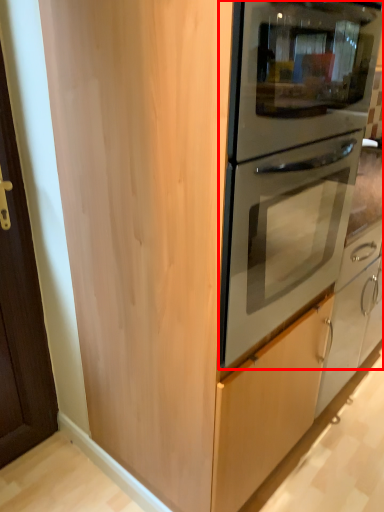
Question: From the image's perspective, considering the relative positions of oven (annotated by the red box) and door handle in the image provided, where is oven (annotated by the red box) located with respect to the staircase?

Choices:
 (A) below
 (B) above

Answer: (B)